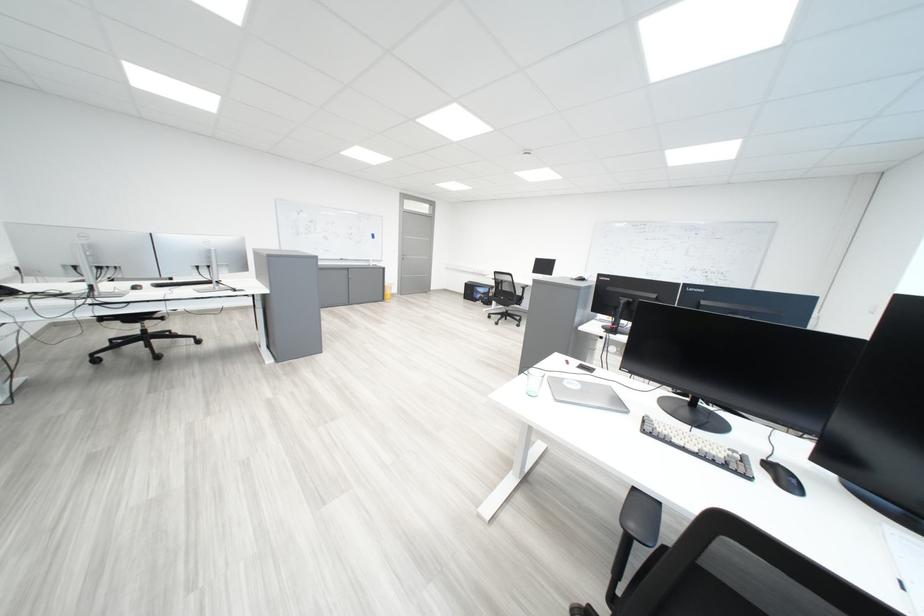
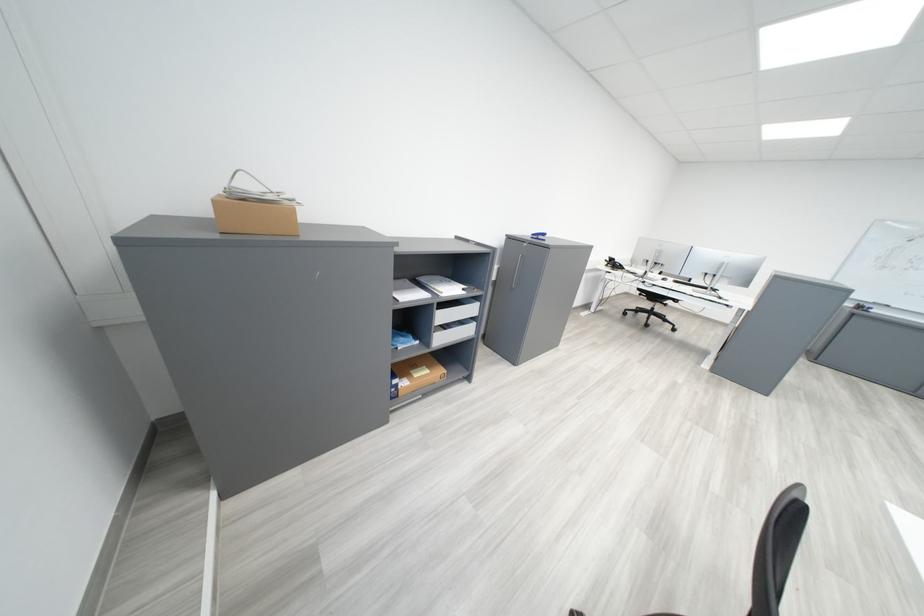
How did the camera likely rotate?

The camera's rotation is toward left-down.